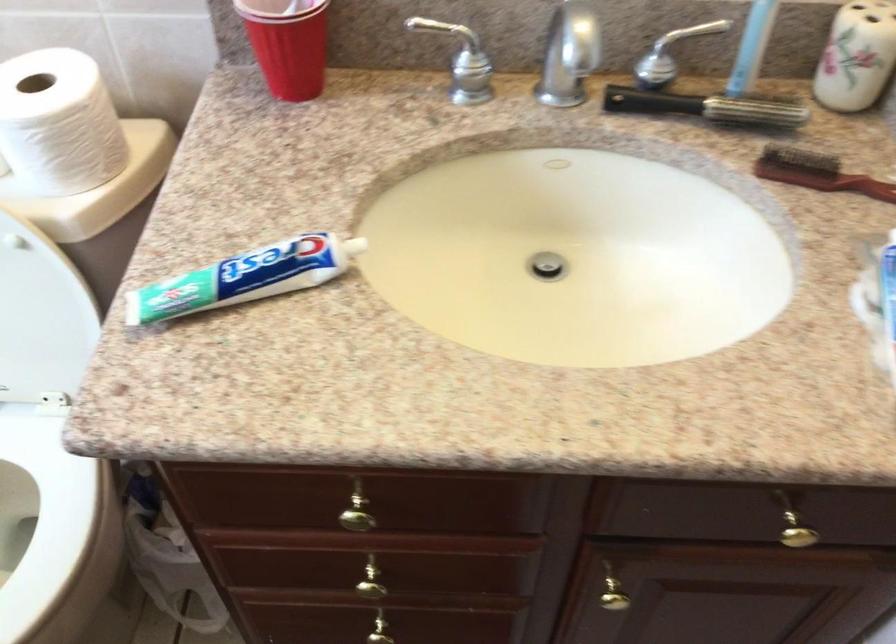
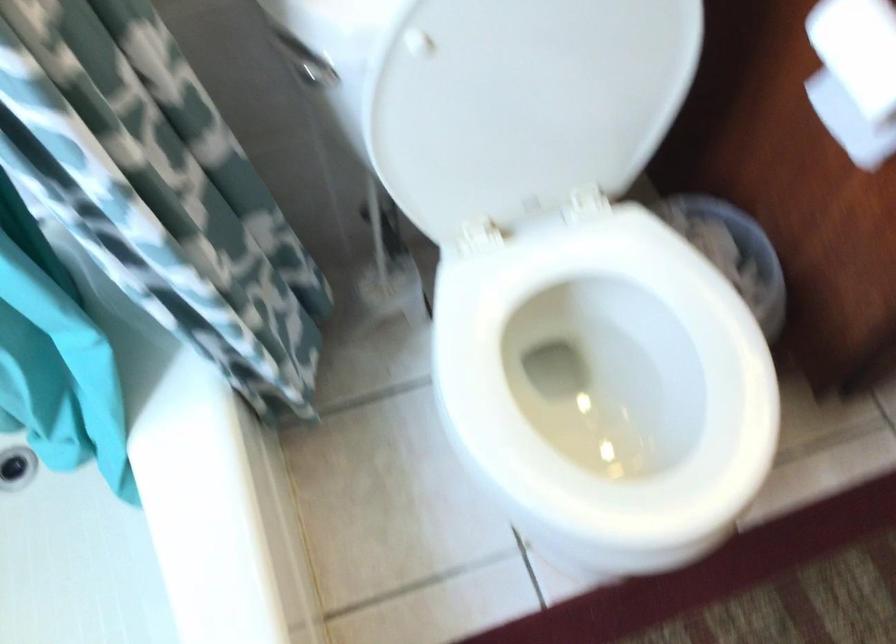
Where in the second image is the point corresponding to (106,360) from the first image?

(855, 76)